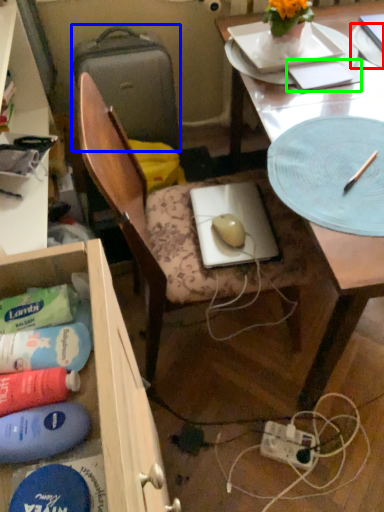
Question: Which object is the closest to the paper plate (highlighted by a red box)? Choose among these: suitcase (highlighted by a blue box) or notepad (highlighted by a green box).

Choices:
 (A) suitcase
 (B) notepad

Answer: (B)